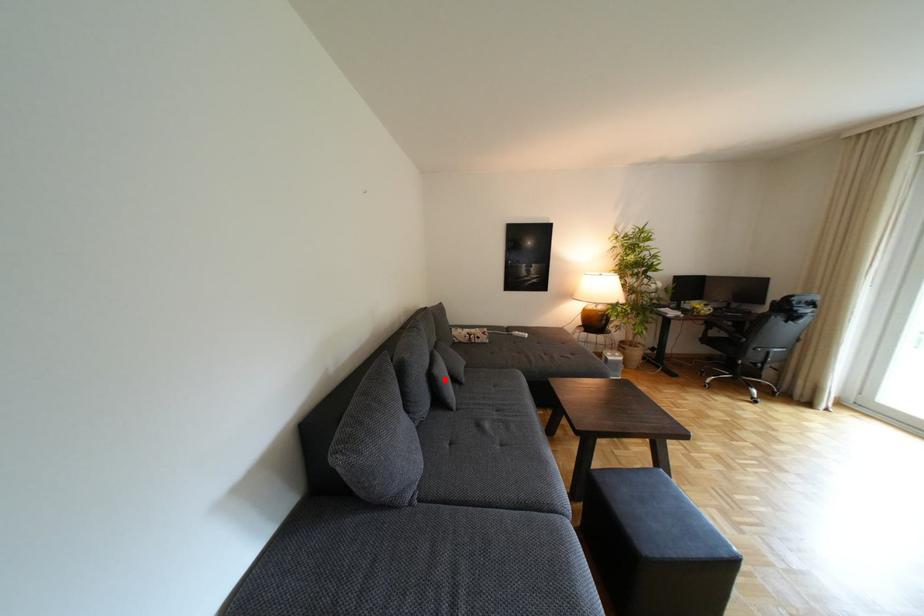
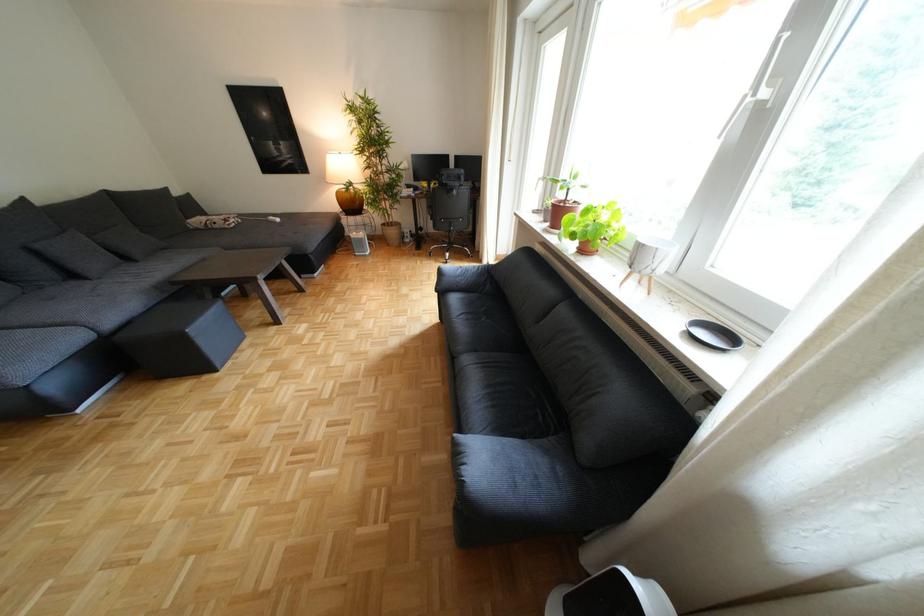
Locate, in the second image, the point that corresponds to the highlighted location in the first image.

(49, 253)